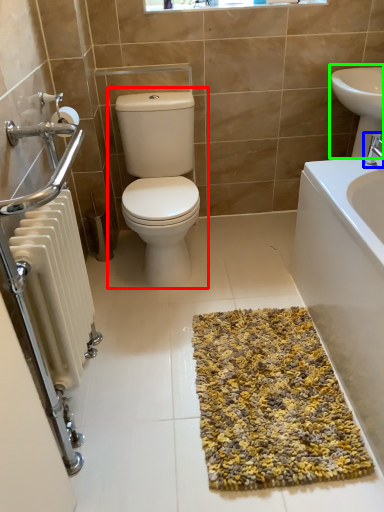
Question: Based on their relative distances, which object is nearer to toilet (highlighted by a red box)? Choose from tap (highlighted by a blue box) and sink (highlighted by a green box).

Choices:
 (A) tap
 (B) sink

Answer: (B)